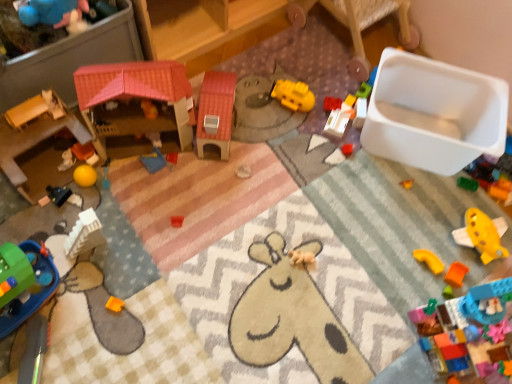
I want to click on free space to the left of black plastic toy at lower left, the 13th toy from the right, so click(27, 193).